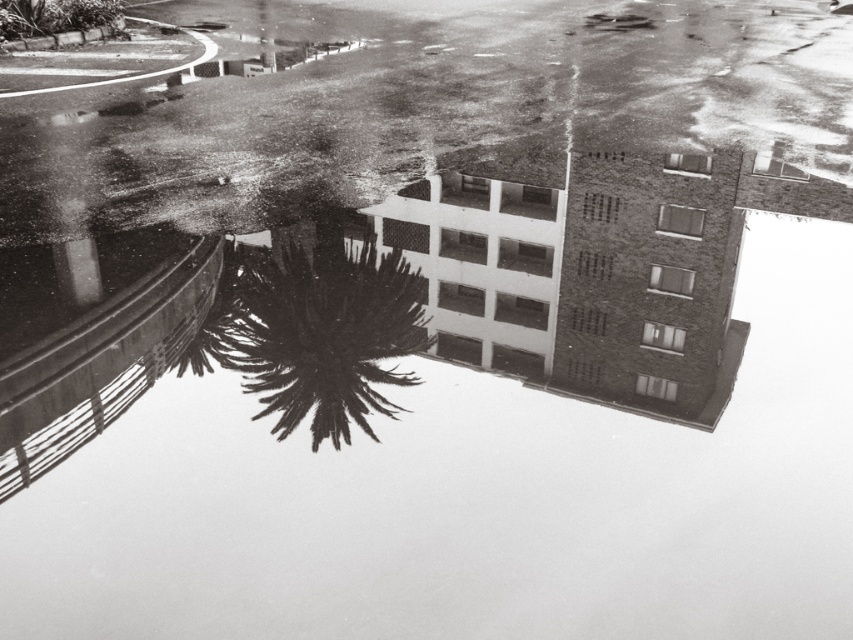
You are standing in front of the reflective surface shown in the image. You see the dark green spiky palm tree at center and the green leafy tree at upper left. Which tree is positioned more to the right side of the reflection?

The dark green spiky palm tree at center is positioned more to the right side of the reflection compared to the green leafy tree at upper left.